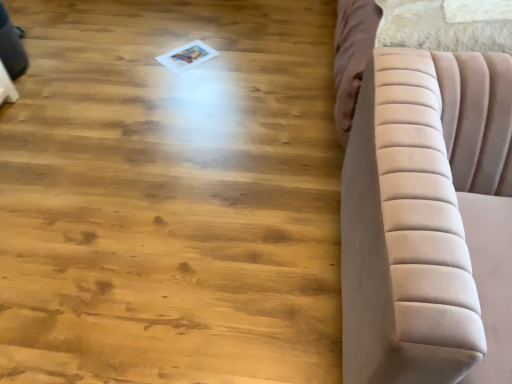
The image size is (512, 384). Identify the location of natural wood floor at center. coord(170,196).

The image size is (512, 384). What do you see at coordinates (170, 196) in the screenshot?
I see `natural wood floor at center` at bounding box center [170, 196].

Where is `velvet beige sofa at right`? velvet beige sofa at right is located at coordinates (428, 221).

This screenshot has width=512, height=384. What do you see at coordinates (428, 221) in the screenshot?
I see `velvet beige sofa at right` at bounding box center [428, 221].

Find the location of a particular element. The width and height of the screenshot is (512, 384). natural wood floor at center is located at coordinates (170, 196).

Looking at this image, which is more to the left, natural wood floor at center or velvet beige sofa at right?

Positioned to the left is natural wood floor at center.

Which object is further away from the camera taking this photo, natural wood floor at center or velvet beige sofa at right?

natural wood floor at center.

Which point is more forward, (122, 70) or (372, 294)?

The point (372, 294) is in front.

Looking at this image, from the image's perspective, which is below, natural wood floor at center or velvet beige sofa at right?

From the image's view, velvet beige sofa at right is below.

From a real-world perspective, is natural wood floor at center above or below velvet beige sofa at right?

natural wood floor at center is situated lower than velvet beige sofa at right in the real world.

Based on the photo, which of these two, natural wood floor at center or velvet beige sofa at right, is thinner?

velvet beige sofa at right.

Who is taller, natural wood floor at center or velvet beige sofa at right?

Standing taller between the two is velvet beige sofa at right.

Does natural wood floor at center have a smaller size compared to velvet beige sofa at right?

Yes, natural wood floor at center is smaller than velvet beige sofa at right.

Would you say natural wood floor at center is outside velvet beige sofa at right?

natural wood floor at center lies outside velvet beige sofa at right's area.

Are natural wood floor at center and velvet beige sofa at right beside each other?

No, natural wood floor at center is not next to velvet beige sofa at right.

Is natural wood floor at center aimed at velvet beige sofa at right?

No, natural wood floor at center is not aimed at velvet beige sofa at right.

Image resolution: width=512 pixels, height=384 pixels. In order to click on furniture above the natural wood floor at center (from a real-world perspective) in this screenshot , I will do `click(428, 221)`.

Would you say velvet beige sofa at right is to the left or to the right of natural wood floor at center in the picture?

velvet beige sofa at right is to the right of natural wood floor at center.

Which object is further away from the camera, velvet beige sofa at right or natural wood floor at center?

natural wood floor at center is further away from the camera.

Is point (400, 98) closer to camera compared to point (80, 182)?

Yes, it is in front of point (80, 182).

From the image's perspective, which one is positioned higher, velvet beige sofa at right or natural wood floor at center?

natural wood floor at center appears higher in the image.

From a real-world perspective, which is physically below, velvet beige sofa at right or natural wood floor at center?

natural wood floor at center, from a real-world perspective.

Which object is thinner, velvet beige sofa at right or natural wood floor at center?

velvet beige sofa at right is thinner.

Between velvet beige sofa at right and natural wood floor at center, which one has more height?

With more height is velvet beige sofa at right.

Between velvet beige sofa at right and natural wood floor at center, which one has larger size?

With larger size is velvet beige sofa at right.

Is velvet beige sofa at right completely or partially outside of natural wood floor at center?

Yes, velvet beige sofa at right is located beyond the bounds of natural wood floor at center.

Is velvet beige sofa at right placed right next to natural wood floor at center?

No, velvet beige sofa at right is not in contact with natural wood floor at center.

Is velvet beige sofa at right oriented towards natural wood floor at center?

No, velvet beige sofa at right is not facing towards natural wood floor at center.

How much distance is there between velvet beige sofa at right and natural wood floor at center?

velvet beige sofa at right and natural wood floor at center are 32.23 inches apart from each other.

Image resolution: width=512 pixels, height=384 pixels. Find the location of `hardwood above the velvet beige sofa at right (from the image's perspective)`. hardwood above the velvet beige sofa at right (from the image's perspective) is located at coordinates (170, 196).

I want to click on furniture that appears below the natural wood floor at center (from the image's perspective), so click(428, 221).

Locate an element on the screen. furniture that appears on the right of natural wood floor at center is located at coordinates (428, 221).